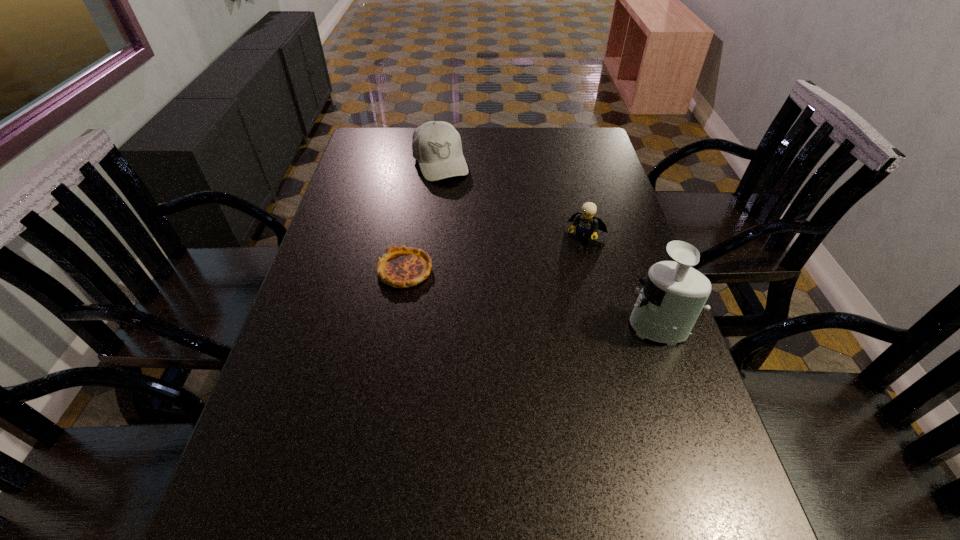
Where is `vacant region located 0.330m on the front-facing side of the baseball cap`? The height and width of the screenshot is (540, 960). vacant region located 0.330m on the front-facing side of the baseball cap is located at coordinates (478, 246).

Image resolution: width=960 pixels, height=540 pixels. In order to click on vacant point located 0.120m on the front-facing side of the Lego in this screenshot , I will do `click(565, 274)`.

Identify the location of free space located 0.290m on the front-facing side of the Lego. (x=542, y=319).

Locate an element on the screen. The width and height of the screenshot is (960, 540). vacant space located on the front-facing side of the Lego is located at coordinates (562, 281).

Locate an element on the screen. This screenshot has width=960, height=540. object located at the far edge is located at coordinates tap(436, 145).

Identify the location of juicer located at the right edge. (674, 294).

Identify the location of Lego that is at the right edge. The width and height of the screenshot is (960, 540). [586, 223].

This screenshot has width=960, height=540. What are the coordinates of `vacant area at the far edge` in the screenshot? It's located at (493, 159).

Image resolution: width=960 pixels, height=540 pixels. In the image, there is a desktop. What are the coordinates of `vacant space at the near edge` in the screenshot? It's located at (563, 490).

What are the coordinates of `free spot at the left edge of the desktop` in the screenshot? It's located at (358, 178).